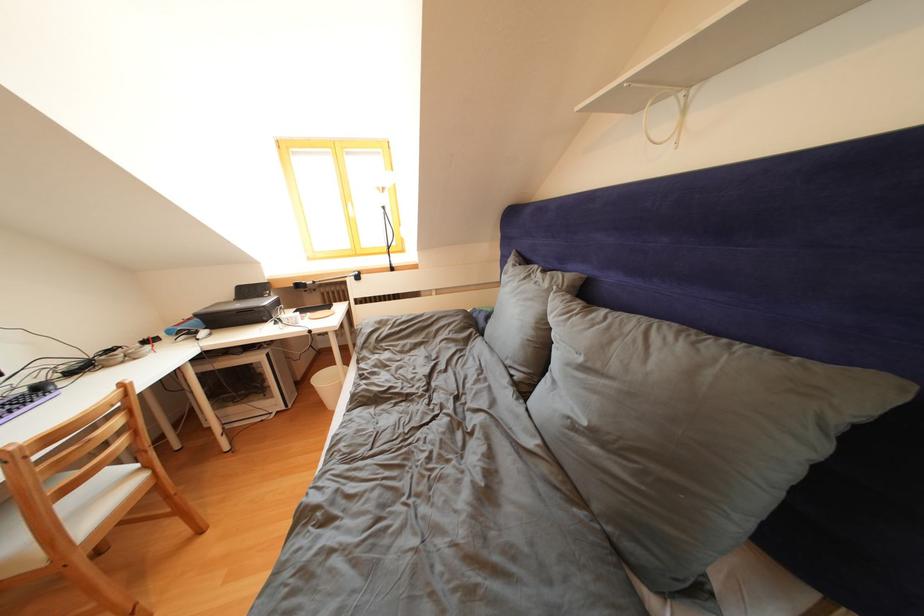
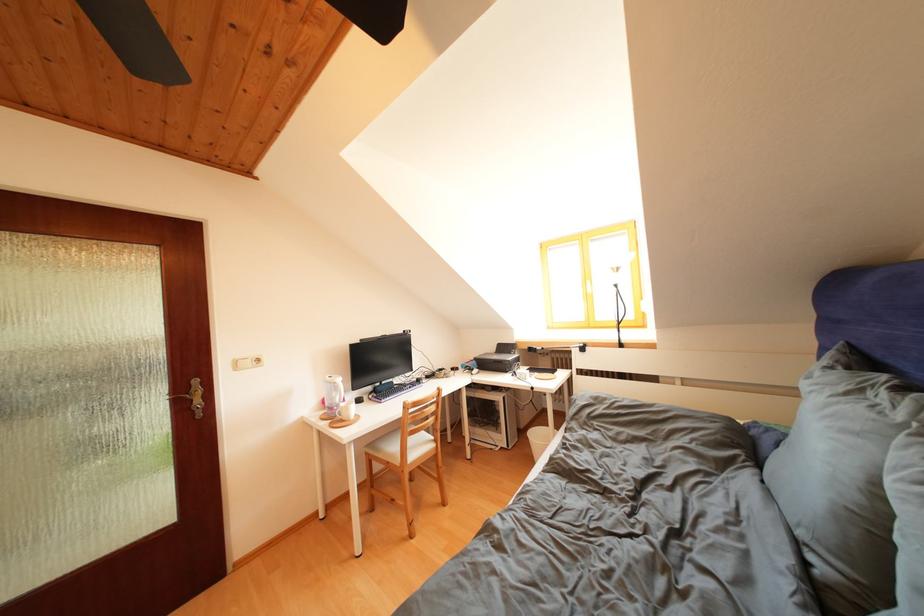
Find the pixel in the second image that matches (76,509) in the first image.

(419, 446)